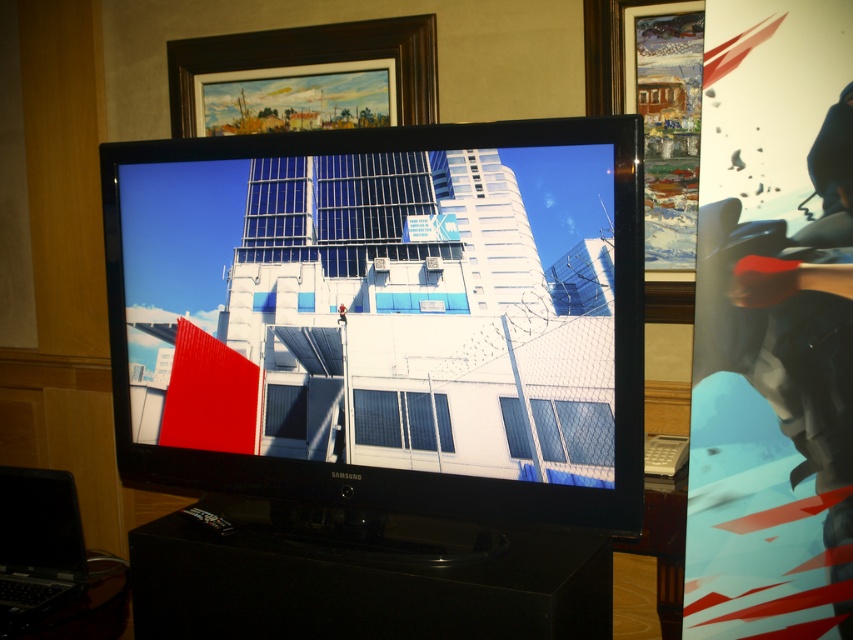
Question: Does black matte entertainment center at center appear over dark wood picture frame at upper center?

Choices:
 (A) no
 (B) yes

Answer: (A)

Question: Does matte black television at center have a greater width compared to black matte entertainment center at center?

Choices:
 (A) no
 (B) yes

Answer: (B)

Question: Which point appears closest to the camera in this image?

Choices:
 (A) (477, 438)
 (B) (335, 596)
 (C) (27, 538)

Answer: (B)

Question: Based on their relative distances, which object is farther from the metallic silver motorcycle at right?

Choices:
 (A) matte black television at center
 (B) black matte laptop at lower left
 (C) dark wood picture frame at upper center
 (D) black matte entertainment center at center

Answer: (B)

Question: Does metallic silver motorcycle at right lie behind dark wood picture frame at upper center?

Choices:
 (A) yes
 (B) no

Answer: (B)

Question: Estimate the real-world distances between objects in this image. Which object is closer to the matte black television at center?

Choices:
 (A) black matte laptop at lower left
 (B) metallic silver motorcycle at right
 (C) black matte entertainment center at center

Answer: (C)